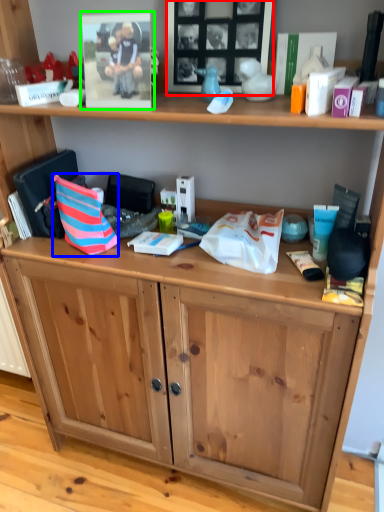
Question: Which object is positioned closest to picture frame (highlighted by a red box)? Select from handbag (highlighted by a blue box) and picture frame (highlighted by a green box).

Choices:
 (A) handbag
 (B) picture frame

Answer: (B)